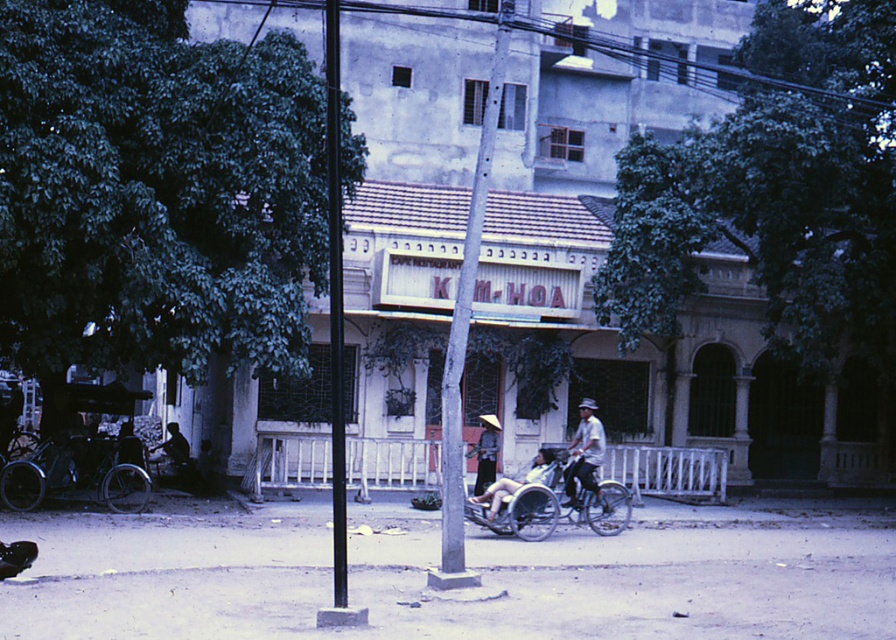
Question: Can you confirm if metallic silver tricycle at lower left is smaller than light brown wooden bicycle at center?

Choices:
 (A) yes
 (B) no

Answer: (B)

Question: Which point appears closest to the camera in this image?

Choices:
 (A) (445, 588)
 (B) (522, 483)

Answer: (A)

Question: Which of the following is the farthest from the observer?

Choices:
 (A) (490, 445)
 (B) (179, 460)
 (C) (90, 454)

Answer: (B)

Question: Can you confirm if light brown wooden bicycle at center is positioned below silhouette of person at left?

Choices:
 (A) yes
 (B) no

Answer: (B)

Question: Which object is positioned farthest from the light brown wooden cart at center?

Choices:
 (A) metallic silver tricycle at lower left
 (B) gray concrete pole at center

Answer: (A)

Question: Does matte white hat at center appear on the right side of silhouette of person at left?

Choices:
 (A) yes
 (B) no

Answer: (A)